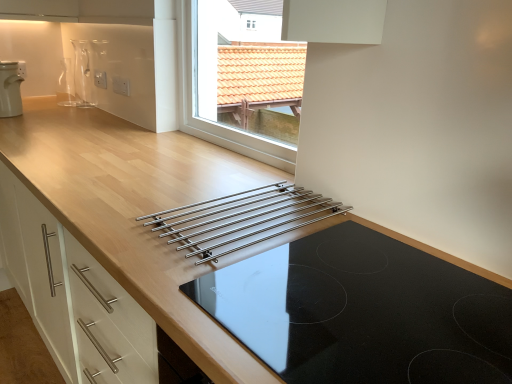
This screenshot has width=512, height=384. What do you see at coordinates (10, 90) in the screenshot?
I see `white plastic kettle at upper left` at bounding box center [10, 90].

This screenshot has height=384, width=512. What do you see at coordinates (82, 74) in the screenshot?
I see `transparent glass vase at upper left` at bounding box center [82, 74].

Identify the location of black glass cooktop at center. (362, 312).

Consider the image. Measure the distance between point (x=351, y=361) and camera.

62.10 centimeters.

The width and height of the screenshot is (512, 384). Identify the location of white plastic kettle at upper left. (10, 90).

Considering the positions of points (272, 200) and (359, 374), is point (272, 200) farther from camera compared to point (359, 374)?

Yes, it is.

From a real-world perspective, who is located lower, stainless steel rack at center or black glass cooktop at center?

black glass cooktop at center is physically lower.

Where is `gas stove on the right of the stainless steel rack at center`? The height and width of the screenshot is (384, 512). gas stove on the right of the stainless steel rack at center is located at coordinates (362, 312).

Is white plastic kettle at upper left taller or shorter than stainless steel rack at center?

Clearly, white plastic kettle at upper left is taller compared to stainless steel rack at center.

Is white plastic kettle at upper left wider or thinner than stainless steel rack at center?

Considering their sizes, white plastic kettle at upper left looks slimmer than stainless steel rack at center.

Considering the relative positions of white plastic kettle at upper left and stainless steel rack at center in the image provided, is white plastic kettle at upper left to the left of stainless steel rack at center from the viewer's perspective?

Correct, you'll find white plastic kettle at upper left to the left of stainless steel rack at center.

From the picture: Which object is positioned more to the left, stainless steel rack at center or white plastic kettle at upper left?

From the viewer's perspective, white plastic kettle at upper left appears more on the left side.

Is stainless steel rack at center facing towards white plastic kettle at upper left?

No, stainless steel rack at center does not turn towards white plastic kettle at upper left.

Is stainless steel rack at center outside of white plastic kettle at upper left?

That's correct, stainless steel rack at center is outside of white plastic kettle at upper left.

At what (x,y) coordinates should I click in order to perform the action: click on appliance behind the white plastic kettle at upper left. Please return your answer as a coordinate pair (x, y). This screenshot has height=384, width=512. Looking at the image, I should click on (82, 74).

Measure the distance from white plastic kettle at upper left to transparent glass vase at upper left.

white plastic kettle at upper left and transparent glass vase at upper left are 18.53 inches apart from each other.

From the image's perspective, is white plastic kettle at upper left on top of transparent glass vase at upper left?

Actually, white plastic kettle at upper left appears below transparent glass vase at upper left in the image.

Does point (78, 66) lie in front of point (213, 214)?

That is False.

From the image's perspective, which one is positioned higher, transparent glass vase at upper left or stainless steel rack at center?

transparent glass vase at upper left, from the image's perspective.

Is transparent glass vase at upper left next to stainless steel rack at center and touching it?

No, transparent glass vase at upper left is not beside stainless steel rack at center.

Which is correct: transparent glass vase at upper left is inside stainless steel rack at center, or outside of it?

The correct answer is: outside.

Considering the relative positions of transparent glass vase at upper left and black glass cooktop at center in the image provided, is transparent glass vase at upper left to the left or to the right of black glass cooktop at center?

From the image, it's evident that transparent glass vase at upper left is to the left of black glass cooktop at center.

Is transparent glass vase at upper left oriented away from black glass cooktop at center?

No, black glass cooktop at center is not at the back of transparent glass vase at upper left.

Can we say transparent glass vase at upper left lies outside black glass cooktop at center?

Yes, transparent glass vase at upper left is not within black glass cooktop at center.

What's the angular difference between transparent glass vase at upper left and black glass cooktop at center's facing directions?

1.52 degrees separate the facing orientations of transparent glass vase at upper left and black glass cooktop at center.

Does point (83, 94) come in front of point (11, 106)?

No, it is behind (11, 106).

From the image's perspective, relative to white plastic kettle at upper left, is transparent glass vase at upper left above or below?

Based on their image positions, transparent glass vase at upper left is located above white plastic kettle at upper left.

This screenshot has height=384, width=512. In order to click on appliance behind the white plastic kettle at upper left in this screenshot , I will do `click(82, 74)`.

This screenshot has height=384, width=512. In order to click on kitchen appliance above the black glass cooktop at center (from the image's perspective) in this screenshot , I will do `click(242, 219)`.

Where is `kitchen appliance below the white plastic kettle at upper left (from the image's perspective)`? kitchen appliance below the white plastic kettle at upper left (from the image's perspective) is located at coordinates (242, 219).

Considering their positions, is stainless steel rack at center positioned further to black glass cooktop at center than white plastic kettle at upper left?

white plastic kettle at upper left is further to black glass cooktop at center.

Based on their spatial positions, is stainless steel rack at center or white plastic kettle at upper left closer to transparent glass vase at upper left?

white plastic kettle at upper left is positioned closer to the anchor transparent glass vase at upper left.

From the image, which object appears to be farther from transparent glass vase at upper left, stainless steel rack at center or black glass cooktop at center?

Among the two, black glass cooktop at center is located further to transparent glass vase at upper left.

Estimate the real-world distances between objects in this image. Which object is further from black glass cooktop at center, stainless steel rack at center or transparent glass vase at upper left?

Based on the image, transparent glass vase at upper left appears to be further to black glass cooktop at center.

Which object lies nearer to the anchor point white plastic kettle at upper left, transparent glass vase at upper left or black glass cooktop at center?

The object closer to white plastic kettle at upper left is transparent glass vase at upper left.

Estimate the real-world distances between objects in this image. Which object is further from black glass cooktop at center, white plastic kettle at upper left or stainless steel rack at center?

white plastic kettle at upper left is positioned further to the anchor black glass cooktop at center.

When comparing their distances from white plastic kettle at upper left, does stainless steel rack at center or black glass cooktop at center seem further?

black glass cooktop at center is positioned further to the anchor white plastic kettle at upper left.

When comparing their distances from stainless steel rack at center, does transparent glass vase at upper left or white plastic kettle at upper left seem closer?

white plastic kettle at upper left.

Find the location of `kitchen appliance located between black glass cooktop at center and transparent glass vase at upper left in the depth direction`. kitchen appliance located between black glass cooktop at center and transparent glass vase at upper left in the depth direction is located at coordinates (242, 219).

What are the coordinates of `kitchen appliance between white plastic kettle at upper left and black glass cooktop at center from left to right` in the screenshot? It's located at (242, 219).

The height and width of the screenshot is (384, 512). I want to click on home appliance located between black glass cooktop at center and transparent glass vase at upper left in the depth direction, so click(x=10, y=90).

The width and height of the screenshot is (512, 384). What are the coordinates of `home appliance between stainless steel rack at center and transparent glass vase at upper left along the z-axis` in the screenshot? It's located at (10, 90).